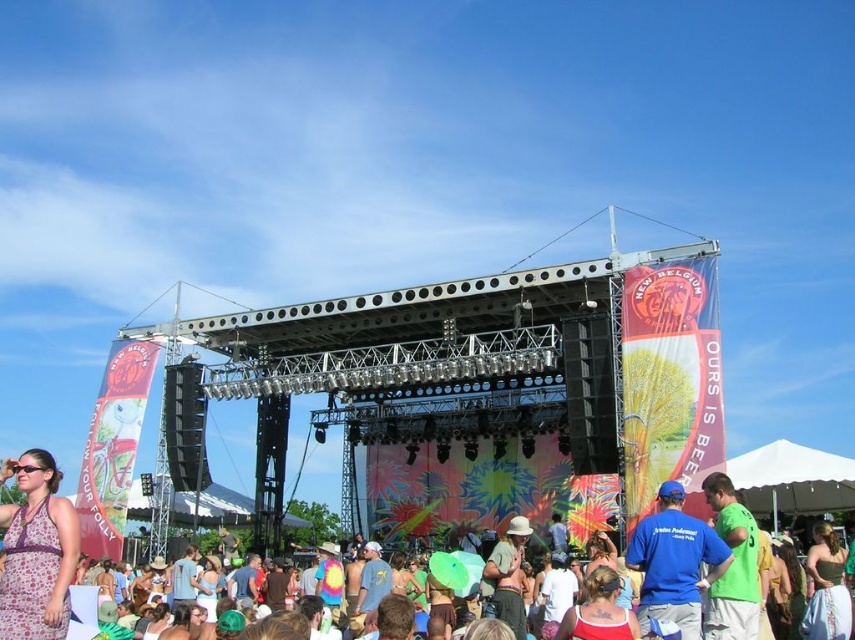
Consider the image. How far apart are floral dress at lower left and green fabric shirt at center?

A distance of 50.21 meters exists between floral dress at lower left and green fabric shirt at center.

Who is more forward, (1, 620) or (732, 566)?

Point (732, 566) is in front.

You are a GUI agent. You are given a task and a screenshot of the screen. Output one action in this format:
    pyautogui.click(x=<x>, y=<y>)
    Task: Click on the floral dress at lower left
    The height and width of the screenshot is (640, 855).
    Given the screenshot: What is the action you would take?
    pyautogui.click(x=36, y=550)

From the picture: Is blue cotton shirt at center positioned in front of green fabric shirt at center?

Yes, it is.

The height and width of the screenshot is (640, 855). I want to click on blue cotton shirt at center, so click(x=674, y=563).

Can you confirm if floral dress at lower left is taller than blue cotton shirt at center?

Yes.

Is point (52, 509) closer to camera compared to point (635, 557)?

That is False.

You are a GUI agent. You are given a task and a screenshot of the screen. Output one action in this format:
    pyautogui.click(x=<x>, y=<y>)
    Task: Click on the floral dress at lower left
    The image size is (855, 640).
    Given the screenshot: What is the action you would take?
    pyautogui.click(x=36, y=550)